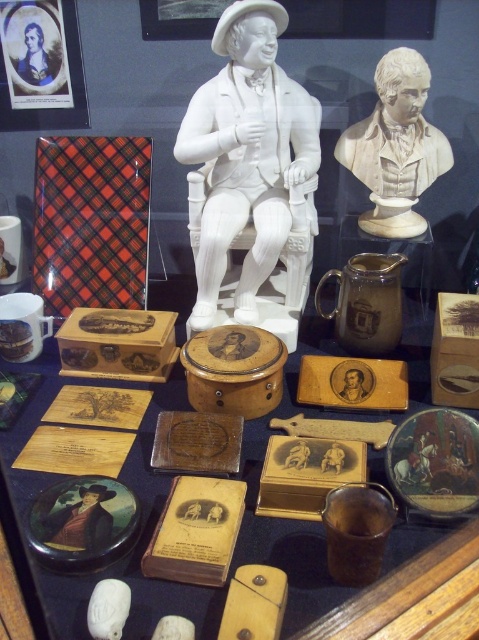
You are a museum curator planning to add a new artifact to the display. The new artifact must be placed to the left of the wooden box at center. Based on the current layout, where should you position the new artifact?

The wooden box at center is located at point (x=241, y=554). To place the new artifact to the left of it, position it to the left of the wooden box at center.

You are a museum curator planning to place a new plaque between the white porcelain statue at center and the white marble bust at upper right. Since the statue is taller, where should the plaque be positioned to ensure it is visible from both sides without being blocked by either object?

The plaque should be placed closer to the base of the white porcelain statue at center since it is taller than the white marble bust at upper right, ensuring visibility from both sides without obstruction.